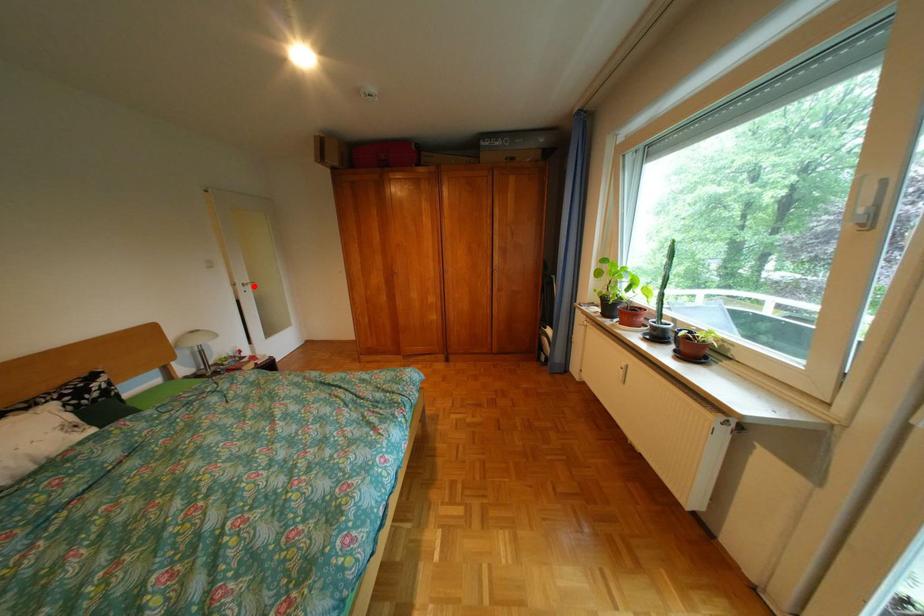
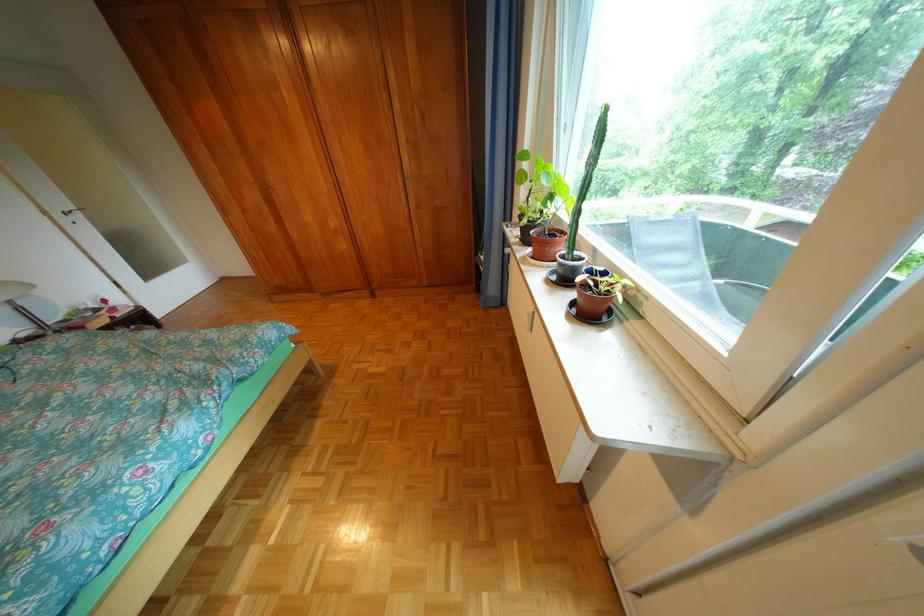
In the second image, find the point that corresponds to the highlighted location in the first image.

(73, 216)